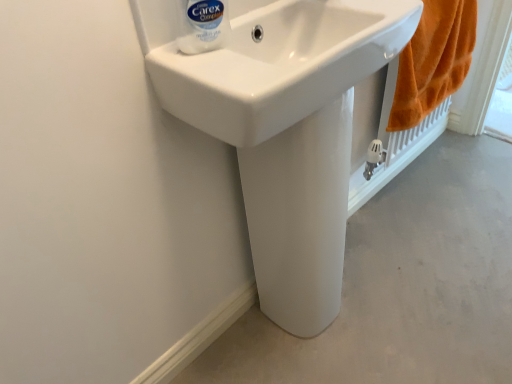
Find the location of a particular element. vacant area that is in front of white glossy pedestal at center is located at coordinates (321, 353).